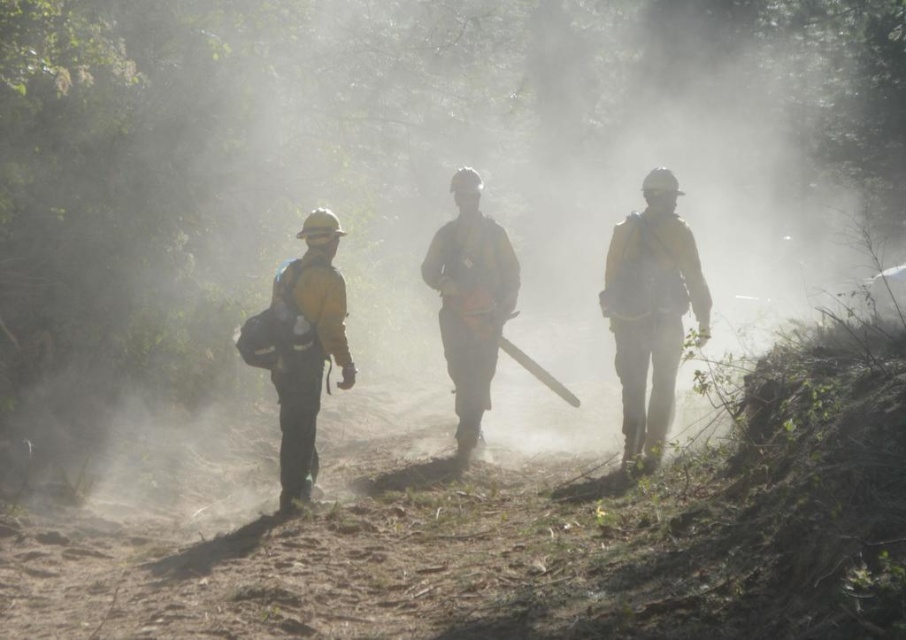
Question: Is yellow fabric chainsaw at center smaller than yellow matte uniform at center?

Choices:
 (A) no
 (B) yes

Answer: (A)

Question: Considering the real-world distances, which object is closest to the yellow fabric chainsaw at center?

Choices:
 (A) yellow matte uniform at right
 (B) yellow matte uniform at center

Answer: (A)

Question: Which point is closer to the camera?

Choices:
 (A) yellow matte uniform at center
 (B) yellow matte uniform at right

Answer: (A)

Question: Can you confirm if yellow fabric chainsaw at center is thinner than yellow matte uniform at center?

Choices:
 (A) no
 (B) yes

Answer: (A)

Question: Can you confirm if yellow matte uniform at right is positioned above yellow fabric chainsaw at center?

Choices:
 (A) yes
 (B) no

Answer: (B)

Question: Which point is closer to the camera taking this photo?

Choices:
 (A) (500, 244)
 (B) (707, 307)
 (C) (331, 291)

Answer: (C)